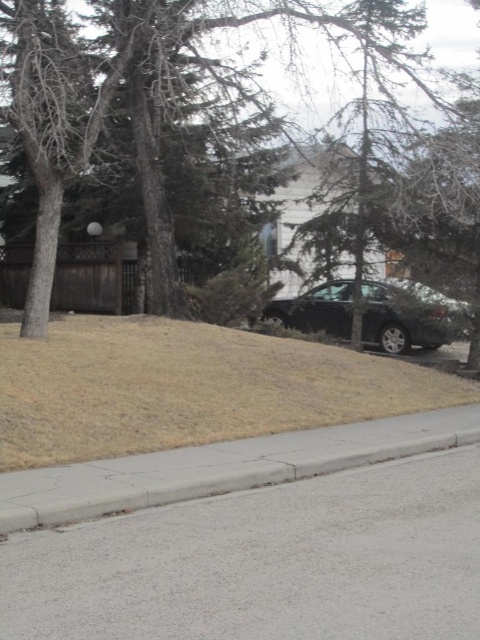
You are a delivery person trying to navigate a narrow path between the brown dry grass at lower center and the brown textured tree at center. Which direction should you move to avoid the tree?

The brown dry grass at lower center is positioned on the left side of the brown textured tree at center, so you should move to the right to avoid the tree.

You are a delivery driver who needs to park your vehicle near the brown dry grass at lower center without blocking the glossy black car at center. Based on the scene, can you park your vehicle there?

The brown dry grass at lower center is below the glossy black car at center, so parking near the brown dry grass at lower center would not block the glossy black car at center as it is positioned lower in the scene.